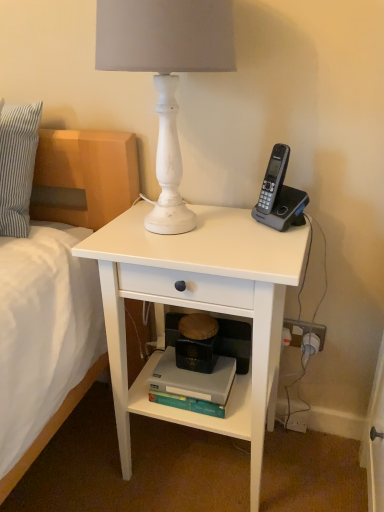
This screenshot has width=384, height=512. I want to click on free space above hardcover book at lower center (from a real-world perspective), so click(186, 368).